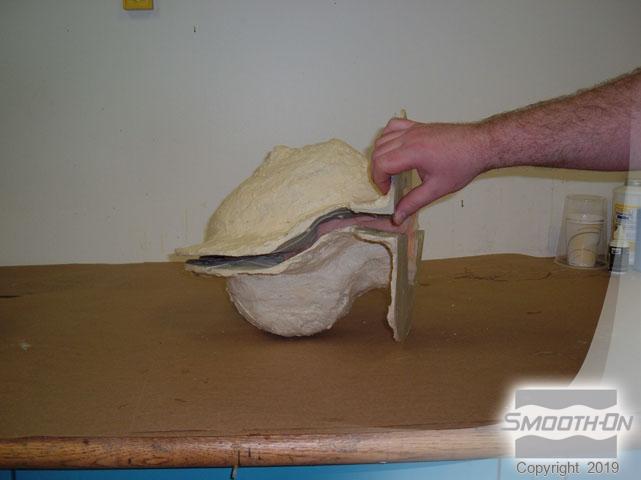
Locate an element on the screen. The image size is (641, 480). blue cabinets underneath is located at coordinates (224, 475), (281, 472).